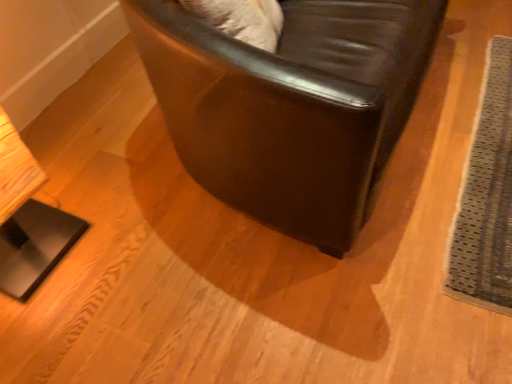
Question: From the image's perspective, relative to textured gray mat at lower right, is shiny black leather chair at center above or below?

Choices:
 (A) above
 (B) below

Answer: (A)

Question: Is shiny black leather chair at center taller or shorter than textured gray mat at lower right?

Choices:
 (A) tall
 (B) short

Answer: (A)

Question: Considering the positions of point (326, 240) and point (448, 281), is point (326, 240) closer or farther from the camera than point (448, 281)?

Choices:
 (A) closer
 (B) farther

Answer: (A)

Question: In terms of height, does textured gray mat at lower right look taller or shorter compared to shiny black leather chair at center?

Choices:
 (A) tall
 (B) short

Answer: (B)

Question: Considering the positions of textured gray mat at lower right and shiny black leather chair at center in the image, is textured gray mat at lower right bigger or smaller than shiny black leather chair at center?

Choices:
 (A) small
 (B) big

Answer: (A)

Question: From a real-world perspective, is textured gray mat at lower right physically located above or below shiny black leather chair at center?

Choices:
 (A) below
 (B) above

Answer: (A)

Question: Considering their positions, is textured gray mat at lower right located in front of or behind shiny black leather chair at center?

Choices:
 (A) behind
 (B) front

Answer: (A)